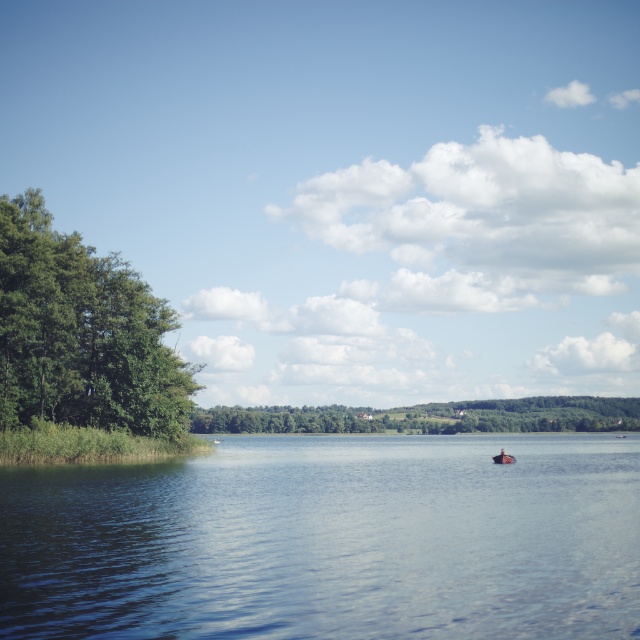
Question: Which is farther from the wooden boat at center?

Choices:
 (A) green leafy trees at center
 (B) green leafy tree at left
 (C) blue smooth water at center

Answer: (A)

Question: Which point is farther from the camera taking this photo?

Choices:
 (A) (504, 456)
 (B) (124, 321)

Answer: (B)

Question: Is the position of blue smooth water at center more distant than that of wooden boat at center?

Choices:
 (A) yes
 (B) no

Answer: (B)

Question: Does green leafy tree at left appear on the left side of wooden boat at center?

Choices:
 (A) no
 (B) yes

Answer: (B)

Question: Which point is closer to the camera?

Choices:
 (A) green leafy tree at left
 (B) wooden boat at center

Answer: (A)

Question: Considering the relative positions of green leafy tree at left and green leafy trees at center in the image provided, where is green leafy tree at left located with respect to green leafy trees at center?

Choices:
 (A) right
 (B) left

Answer: (B)